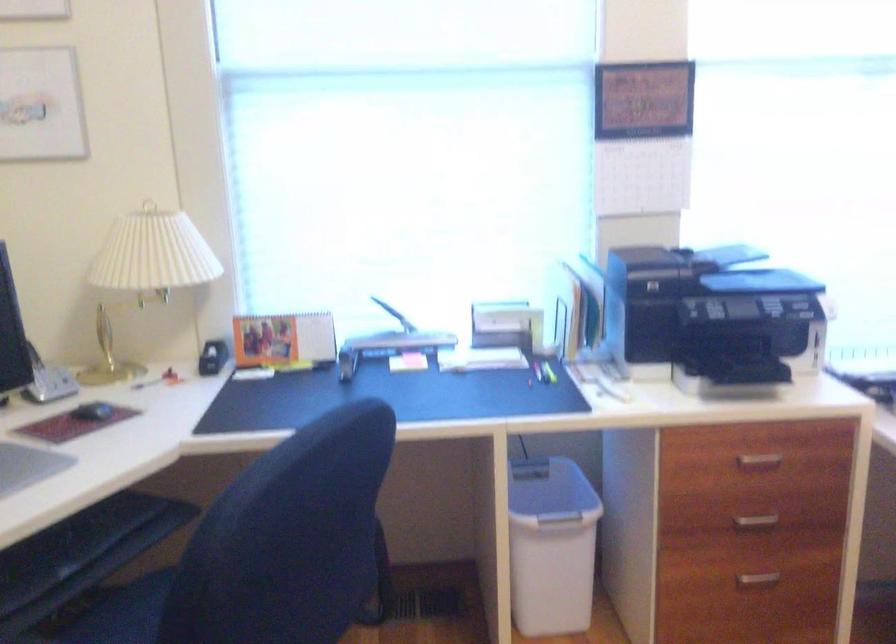
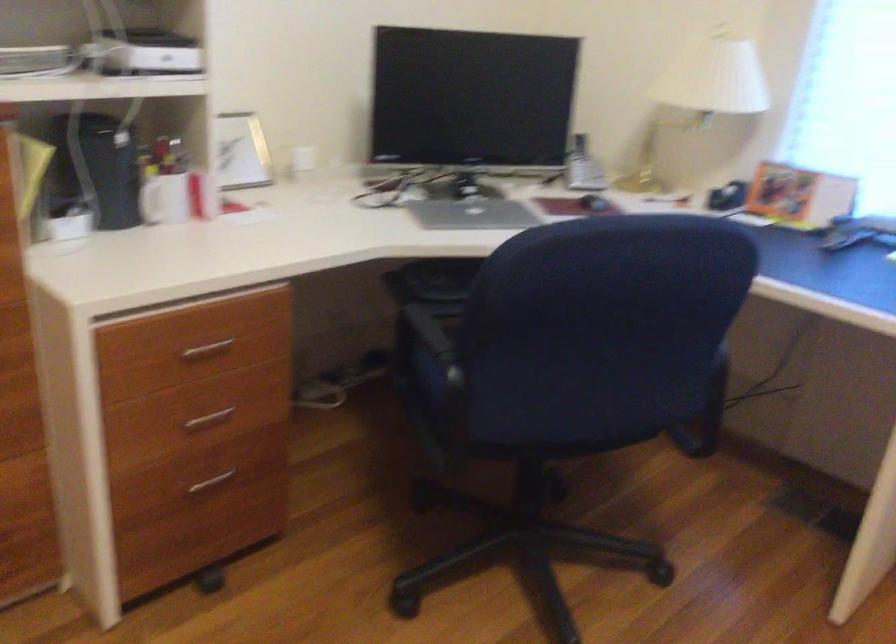
Question: How did the camera likely rotate?

Choices:
 (A) Left
 (B) Right
 (C) Up
 (D) Down

Answer: (A)